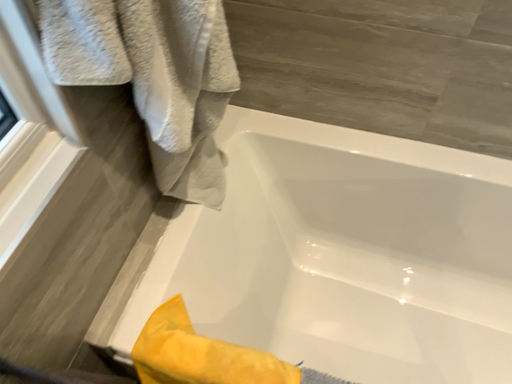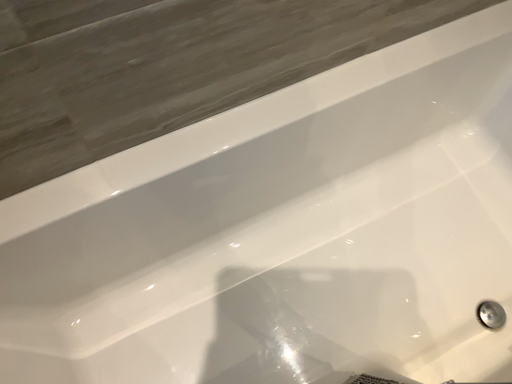
Question: Which way did the camera rotate in the video?

Choices:
 (A) rotated left
 (B) rotated right

Answer: (B)